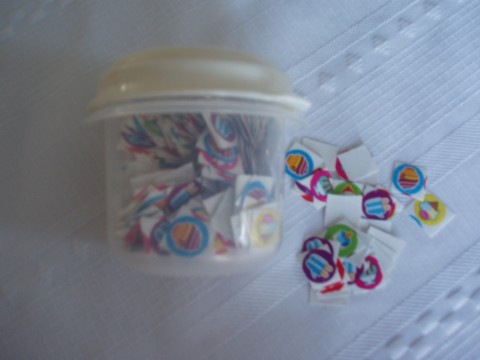
This screenshot has width=480, height=360. I want to click on sticker, so click(x=318, y=266).